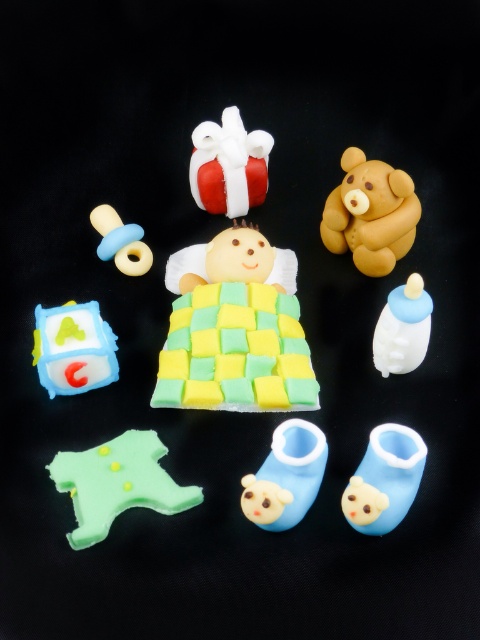
You are standing 5 feet away from the brown matte teddy bear at upper center. Can you reach it without moving closer?

The distance between you and the brown matte teddy bear at upper center is 4.38 feet, so yes, you can reach it without moving closer since you are only 5 feet away.

You are a parent trying to choose a gift for a baby shower. You see the brown matte teddy bear at upper center and the white glossy baby bottle at right. Which item is bigger in size?

The brown matte teddy bear at upper center is larger in size compared to the white glossy baby bottle at right.

Consider the image. You are looking at the baby decoration setup. There are two points marked in the image. The first point is at coordinates point (213,154) and the second is at point (286,368). Which point is closer to you?

Point (213,154) is further to the viewer than point (286,368), so the first point is closer to you.